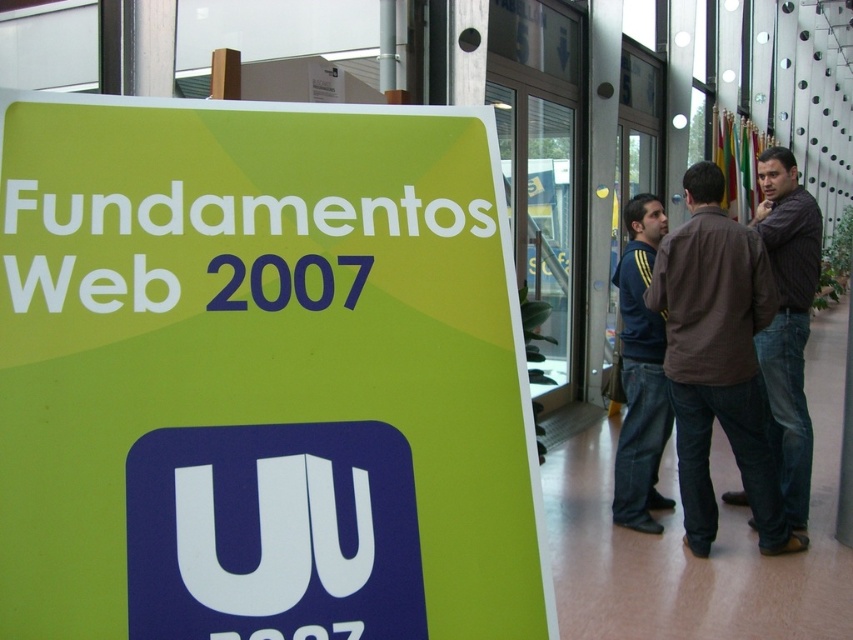
How distant is green paper sign at left from brown striped shirt at right?

green paper sign at left and brown striped shirt at right are 11.27 feet apart from each other.

Is point (16, 630) positioned in front of point (787, 397)?

Yes, point (16, 630) is in front of point (787, 397).

This screenshot has width=853, height=640. Identify the location of green paper sign at left. (260, 376).

Is brown cotton shirt at right to the left of dark blue jeans at center from the viewer's perspective?

Incorrect, brown cotton shirt at right is not on the left side of dark blue jeans at center.

Does point (747, 353) come in front of point (654, 499)?

Yes, point (747, 353) is closer to viewer.

The height and width of the screenshot is (640, 853). I want to click on brown cotton shirt at right, so click(x=718, y=360).

This screenshot has width=853, height=640. What do you see at coordinates (260, 376) in the screenshot? I see `green paper sign at left` at bounding box center [260, 376].

Is green paper sign at left above dark blue jeans at center?

Indeed, green paper sign at left is positioned over dark blue jeans at center.

Which is in front, point (329, 268) or point (648, 321)?

Point (329, 268)

Image resolution: width=853 pixels, height=640 pixels. I want to click on green paper sign at left, so click(260, 376).